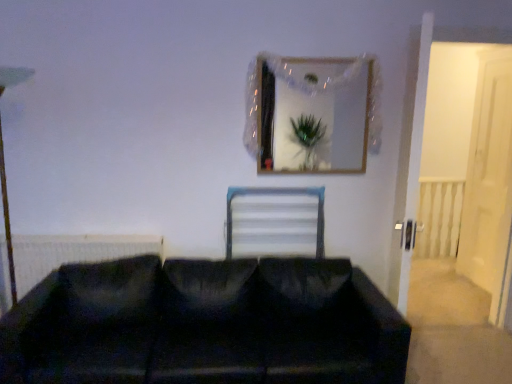
Question: Can you confirm if white glossy door at right is positioned to the right of black fabric studio couch at lower center?

Choices:
 (A) no
 (B) yes

Answer: (B)

Question: From the image's perspective, is white glossy door at right under black fabric studio couch at lower center?

Choices:
 (A) yes
 (B) no

Answer: (B)

Question: Is white glossy door at right surrounding black fabric studio couch at lower center?

Choices:
 (A) no
 (B) yes

Answer: (A)

Question: Does white glossy door at right have a greater height compared to black fabric studio couch at lower center?

Choices:
 (A) yes
 (B) no

Answer: (A)

Question: Does white glossy door at right have a lesser height compared to black fabric studio couch at lower center?

Choices:
 (A) yes
 (B) no

Answer: (B)

Question: Is white glossy door at right bigger than black fabric studio couch at lower center?

Choices:
 (A) no
 (B) yes

Answer: (A)

Question: Is white glossy door at right in front of black matte radiator at left?

Choices:
 (A) yes
 (B) no

Answer: (B)

Question: Is white glossy door at right positioned with its back to black matte radiator at left?

Choices:
 (A) yes
 (B) no

Answer: (B)

Question: From the image's perspective, is white glossy door at right located beneath black matte radiator at left?

Choices:
 (A) yes
 (B) no

Answer: (B)

Question: Can you confirm if white glossy door at right is bigger than black matte radiator at left?

Choices:
 (A) yes
 (B) no

Answer: (A)

Question: Is black matte radiator at left completely or partially inside white glossy door at right?

Choices:
 (A) yes
 (B) no

Answer: (B)

Question: Is white glossy door at right further to camera compared to black matte radiator at left?

Choices:
 (A) yes
 (B) no

Answer: (A)

Question: Considering the relative sizes of wooden frame at upper center and black fabric studio couch at lower center in the image provided, is wooden frame at upper center shorter than black fabric studio couch at lower center?

Choices:
 (A) no
 (B) yes

Answer: (A)